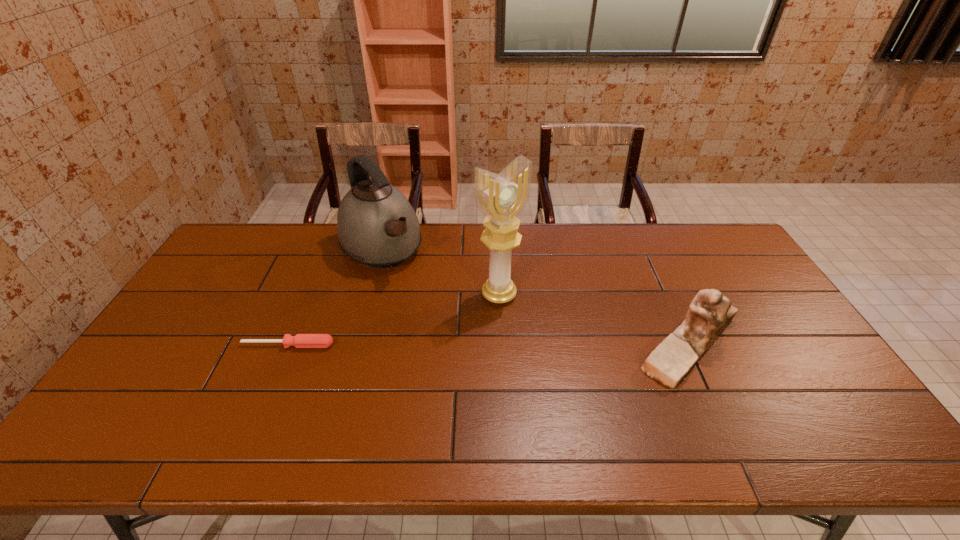
The height and width of the screenshot is (540, 960). Find the location of `vacant spot on the desktop that is between the screwdriver and the second shortest object and is positioned at the spout of the third shortest object`. vacant spot on the desktop that is between the screwdriver and the second shortest object and is positioned at the spout of the third shortest object is located at coordinates (464, 345).

The image size is (960, 540). I want to click on vacant space on the desktop that is between the shortest object and the rightmost object and is positioned on the front-facing side of the tallest object, so click(546, 345).